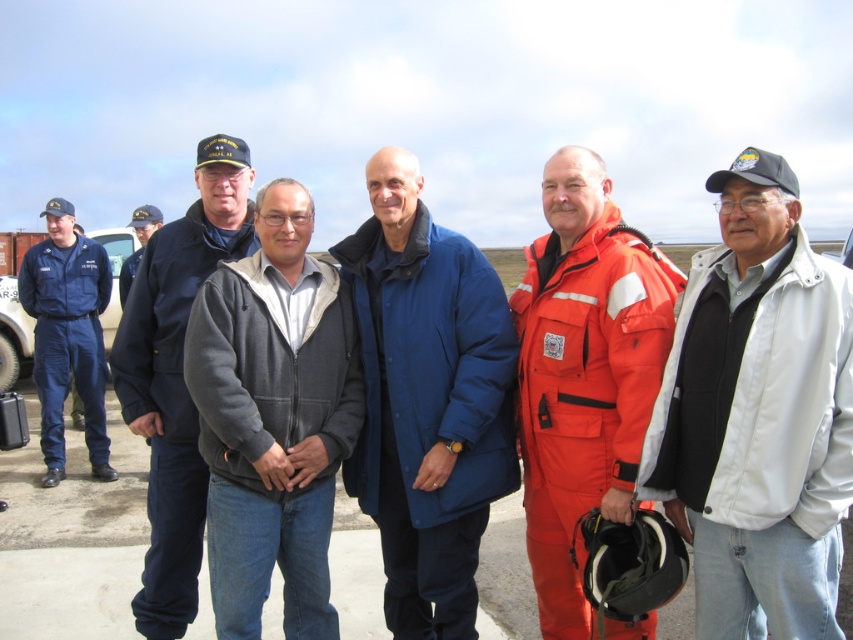
Question: Can you confirm if blue matte jacket at center is positioned above dark blue uniform at center?

Choices:
 (A) yes
 (B) no

Answer: (B)

Question: Can you confirm if orange fabric jumpsuit at center is smaller than navy blue jacket at center?

Choices:
 (A) no
 (B) yes

Answer: (B)

Question: Which object is farther from the camera taking this photo?

Choices:
 (A) dark blue uniform at center
 (B) gray fleece jacket at center
 (C) matte blue jumpsuit at left

Answer: (A)

Question: Which object is positioned farthest from the gray fleece jacket at center?

Choices:
 (A) blue matte jacket at center
 (B) dark blue uniform at center
 (C) orange fabric jumpsuit at center
 (D) navy blue jacket at center

Answer: (B)

Question: Which point appears closest to the camera in this image?

Choices:
 (A) (401, 484)
 (B) (36, 369)

Answer: (A)

Question: Does white matte jacket at center lie in front of navy blue jacket at center?

Choices:
 (A) no
 (B) yes

Answer: (B)